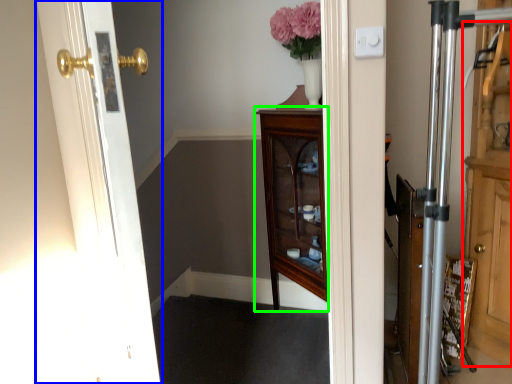
Question: Which is farther away from dresser (highlighted by a red box)? door (highlighted by a blue box) or furniture (highlighted by a green box)?

Choices:
 (A) door
 (B) furniture

Answer: (A)